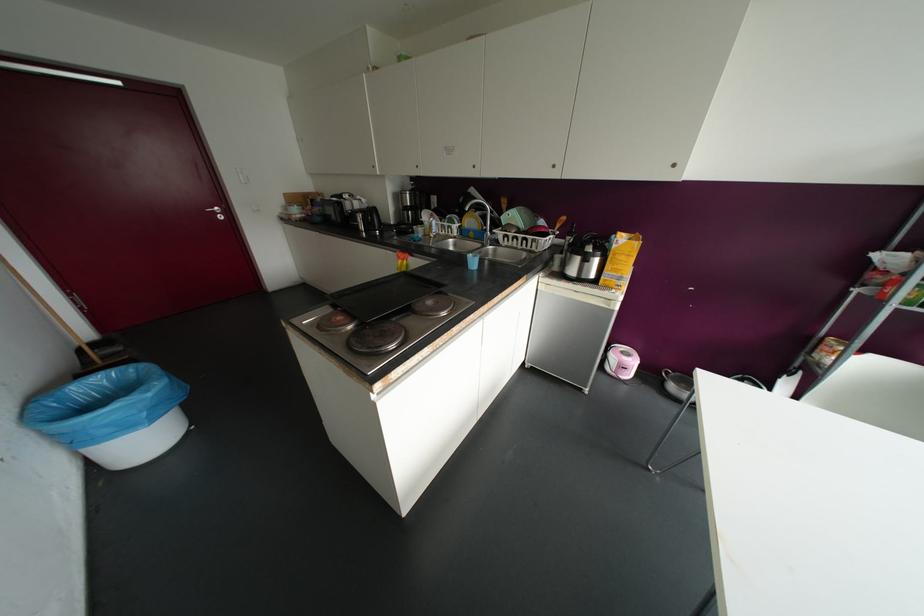
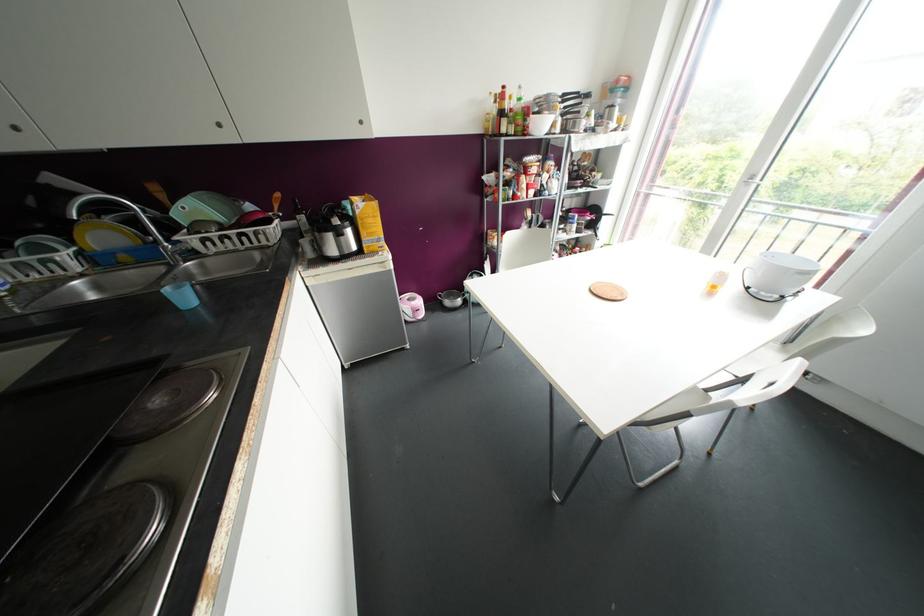
Find the pixel in the second image that matches point (622, 257) in the first image.

(370, 220)